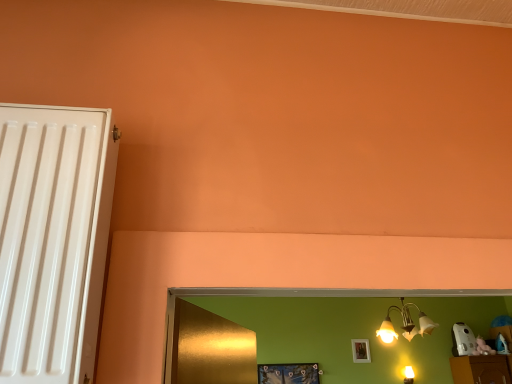
Question: From the image's perspective, is white matte picture frame at upper center, which is the first picture frame in back-to-front order, located beneath metallic blue picture frame at lower center, acting as the 2th picture frame starting from the right?

Choices:
 (A) yes
 (B) no

Answer: (B)

Question: Considering the relative sizes of white matte picture frame at upper center, acting as the 2th picture frame starting from the left, and metallic blue picture frame at lower center, which is the second picture frame in back-to-front order, in the image provided, is white matte picture frame at upper center, acting as the 2th picture frame starting from the left, shorter than metallic blue picture frame at lower center, which is the second picture frame in back-to-front order,?

Choices:
 (A) no
 (B) yes

Answer: (A)

Question: Is white matte picture frame at upper center, which is the first picture frame in back-to-front order, positioned beyond the bounds of metallic blue picture frame at lower center, acting as the 2th picture frame starting from the right?

Choices:
 (A) yes
 (B) no

Answer: (A)

Question: Are white matte picture frame at upper center, which is the first picture frame in back-to-front order, and metallic blue picture frame at lower center, the 1th picture frame in the front-to-back sequence, far apart?

Choices:
 (A) yes
 (B) no

Answer: (B)

Question: From a real-world perspective, does white matte picture frame at upper center, arranged as the 2th picture frame when viewed from the front, sit lower than metallic blue picture frame at lower center, the 1th picture frame in the front-to-back sequence?

Choices:
 (A) yes
 (B) no

Answer: (B)

Question: Is metallic blue picture frame at lower center, the 1th picture frame in the front-to-back sequence, at the back of white matte picture frame at upper center, acting as the 2th picture frame starting from the left?

Choices:
 (A) no
 (B) yes

Answer: (A)

Question: From the image's perspective, would you say metallic gold chandelier at upper right is positioned over white matte picture frame at upper center, arranged as the 2th picture frame when viewed from the front?

Choices:
 (A) yes
 (B) no

Answer: (A)

Question: Is metallic gold chandelier at upper right looking in the opposite direction of white matte picture frame at upper center, arranged as the 2th picture frame when viewed from the front?

Choices:
 (A) no
 (B) yes

Answer: (B)

Question: Is metallic gold chandelier at upper right smaller than white matte picture frame at upper center, acting as the 2th picture frame starting from the left?

Choices:
 (A) no
 (B) yes

Answer: (A)

Question: From the image's perspective, does metallic gold chandelier at upper right appear lower than white matte picture frame at upper center, which appears as the 1th picture frame when viewed from the right?

Choices:
 (A) yes
 (B) no

Answer: (B)

Question: Is metallic gold chandelier at upper right at the left side of white matte picture frame at upper center, arranged as the 2th picture frame when viewed from the front?

Choices:
 (A) yes
 (B) no

Answer: (A)

Question: From a real-world perspective, is metallic gold chandelier at upper right over white matte picture frame at upper center, acting as the 2th picture frame starting from the left?

Choices:
 (A) no
 (B) yes

Answer: (B)

Question: From the image's perspective, is metallic blue picture frame at lower center, the first picture frame when ordered from left to right, on top of white matte picture frame at upper center, which is the first picture frame in back-to-front order?

Choices:
 (A) no
 (B) yes

Answer: (A)